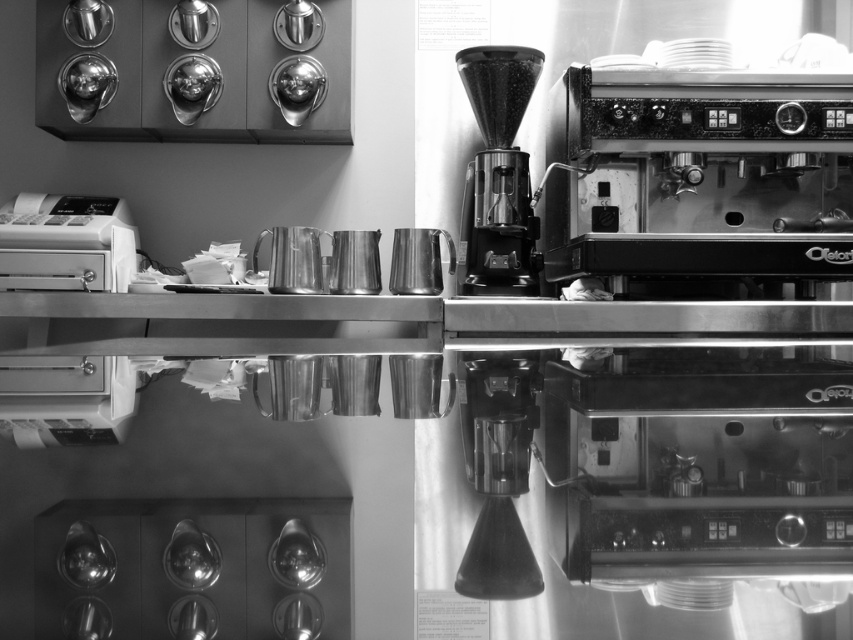
You are a barista who needs to place a new menu board between the white plastic cash register at left and the metallic black coffee grinder at center. Given that the menu board is 15 inches wide, will it fit in the space between them?

The white plastic cash register at left is larger in size than the metallic black coffee grinder at center, but the exact distance between them isn

You are a barista who needs to reach both the white plastic cash register at left and the metallic cylindrical filter at center. Which object is closer to you from your current position at the counter?

The white plastic cash register at left is closer because it is positioned over the metallic cylindrical filter at center, meaning it is nearer to your current position at the counter.

You are a barista working in the coffee shop. You need to place a new order receipt from the printer into the cash register. The cash register is located at point (67,243). The printer is behind the three metallic pitchers on the left side of the countertop. Which direction should you move from the printer to reach the cash register?

The cash register at point (67,243) is located to the left of the three metallic pitchers. Move to the left from the printer to reach the cash register.